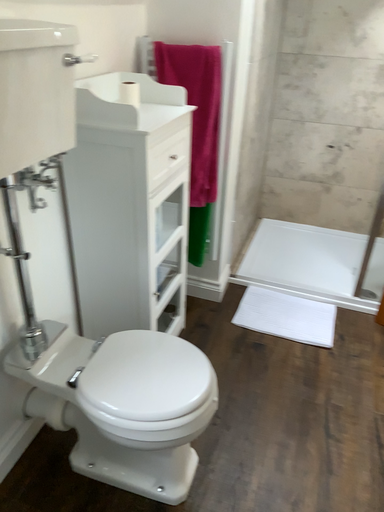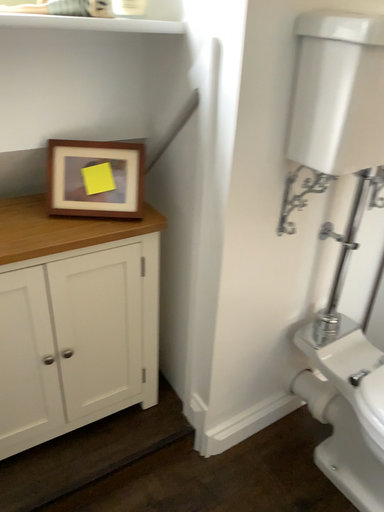
Question: Which way did the camera rotate in the video?

Choices:
 (A) rotated upward
 (B) rotated downward

Answer: (A)